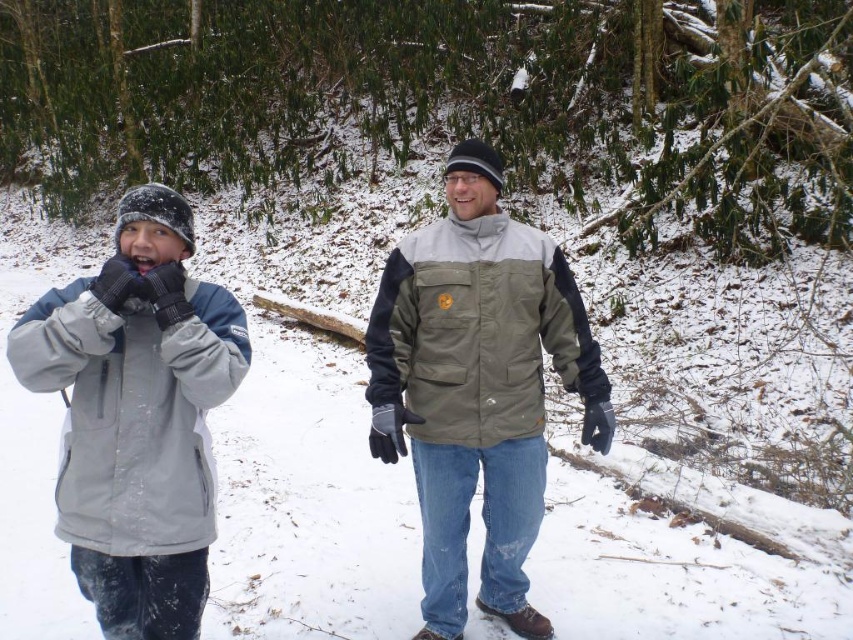
Is point (457, 257) more distant than point (96, 282)?

That is True.

Based on the photo, who is positioned more to the left, matte gray jacket at center or gray soft jacket at left?

Positioned to the left is gray soft jacket at left.

Is point (468, 451) closer to camera compared to point (140, 435)?

No, it is behind (140, 435).

Identify the location of matte gray jacket at center. The width and height of the screenshot is (853, 640). (477, 387).